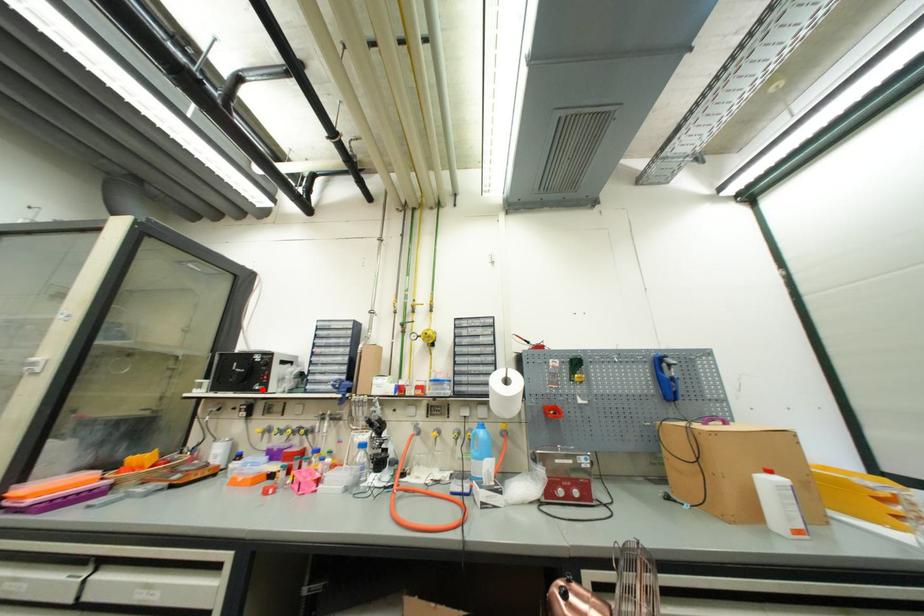
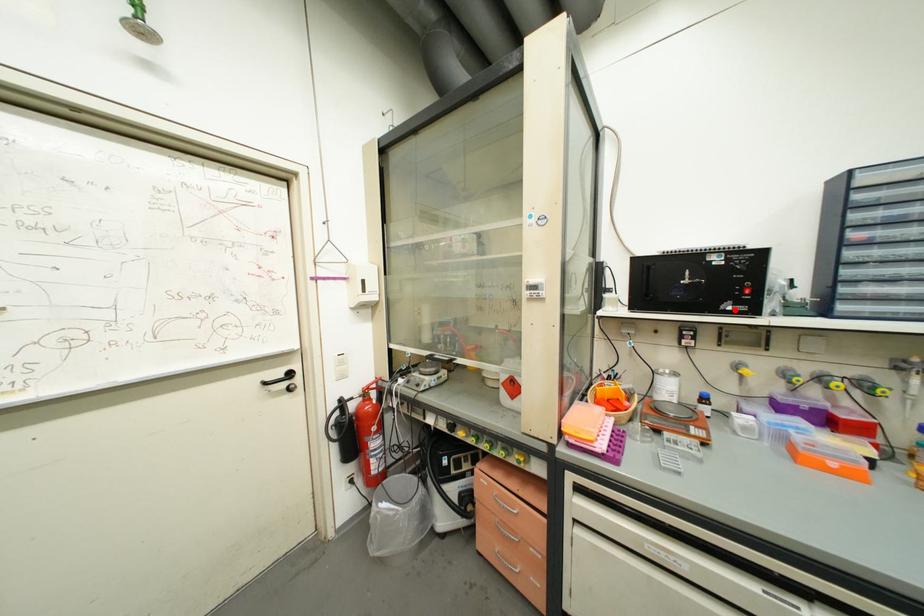
I am providing you with two images of the same scene from different viewpoints. A red point is marked on the first image and another point is marked on the second image. Is the marked point in image1 the same physical position as the marked point in image2?

Yes